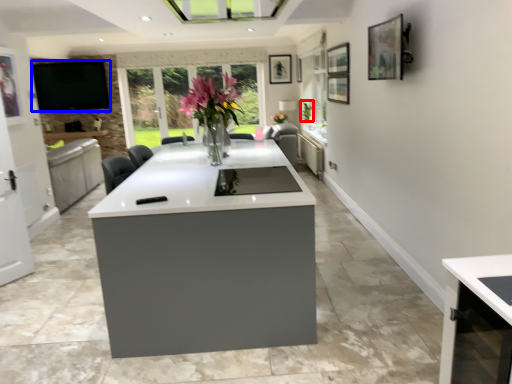
Question: Which point is further to the camera, plant (highlighted by a red box) or window screen (highlighted by a blue box)?

Choices:
 (A) plant
 (B) window screen

Answer: (B)